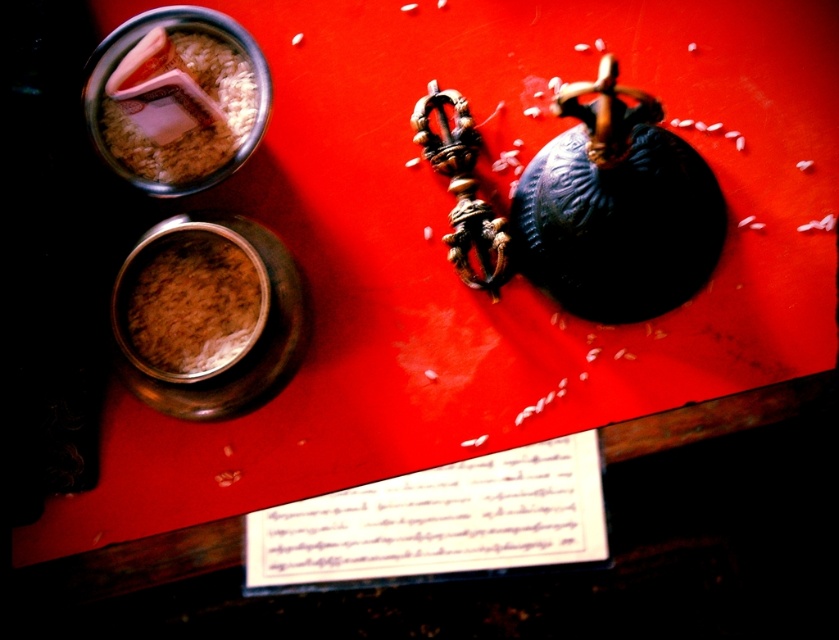
In the scene shown: You are organizing items on a red surface and notice the white matte rice at upper left and the brown matte powder at center. Which item is placed on top of the other?

The white matte rice at upper left is positioned over brown matte powder at center.

You are standing in front of the red surface and want to place a small decoration exactly at the center of the white matte rice at upper left. What are the coordinates where you should place it?

The coordinates for the white matte rice at upper left are at point (176, 106), so you should place the decoration at those coordinates.

Based on the photo, you are organizing a traditional ceremony and need to place the white matte rice at upper left and brown matte powder at center on an altar. The altar has two sections with the left section being smaller than the right. Which object should go where based on their sizes?

The white matte rice at upper left is larger than the brown matte powder at center, so the larger white matte rice at upper left should be placed in the right section of the altar, and the smaller brown matte powder at center in the left section.